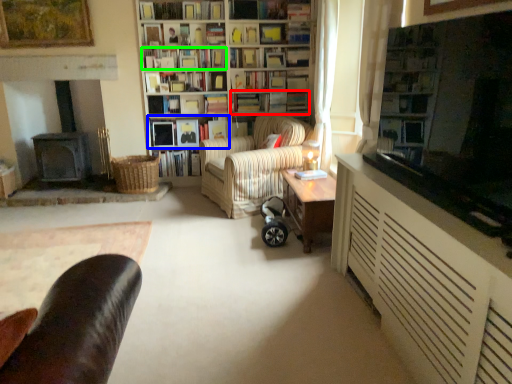
Question: Based on their relative distances, which object is farther from book (highlighted by a red box)? Choose from book (highlighted by a blue box) and book (highlighted by a green box).

Choices:
 (A) book
 (B) book

Answer: (B)